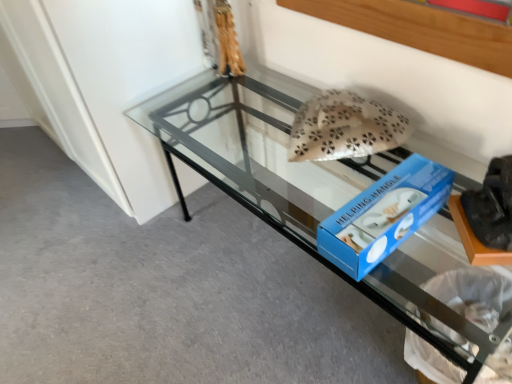
Question: Is clear glass table at center situated inside beige fabric pillow at center or outside?

Choices:
 (A) inside
 (B) outside

Answer: (B)

Question: Does point (309, 177) appear closer or farther from the camera than point (333, 96)?

Choices:
 (A) closer
 (B) farther

Answer: (A)

Question: Based on their positions, is clear glass table at center located to the left or right of beige fabric pillow at center?

Choices:
 (A) left
 (B) right

Answer: (A)

Question: Is beige fabric pillow at center situated inside clear glass table at center or outside?

Choices:
 (A) outside
 (B) inside

Answer: (B)

Question: Considering the positions of beige fabric pillow at center and clear glass table at center in the image, is beige fabric pillow at center wider or thinner than clear glass table at center?

Choices:
 (A) wide
 (B) thin

Answer: (B)

Question: In terms of height, does beige fabric pillow at center look taller or shorter compared to clear glass table at center?

Choices:
 (A) tall
 (B) short

Answer: (B)

Question: Relative to clear glass table at center, is beige fabric pillow at center in front or behind?

Choices:
 (A) front
 (B) behind

Answer: (B)